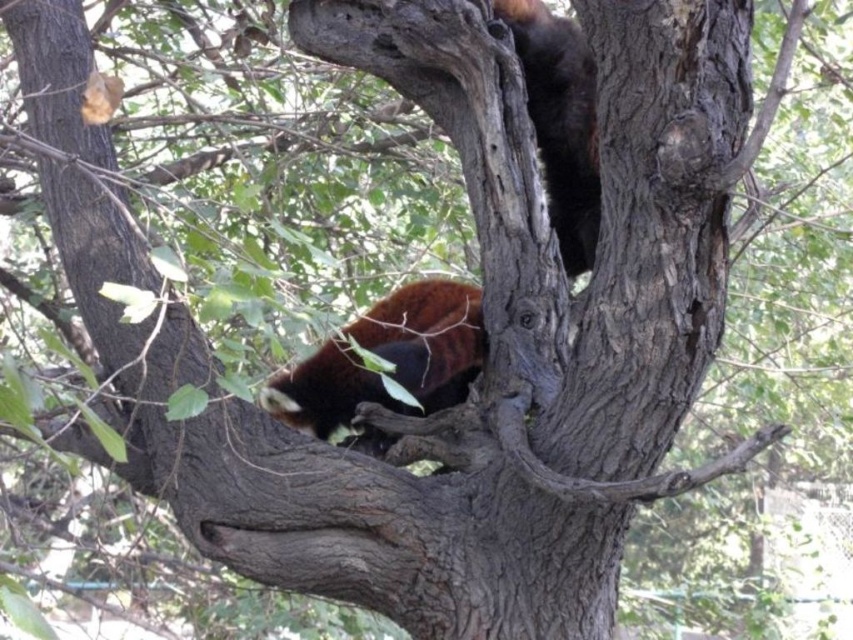
You are a wildlife photographer aiming to capture the red panda in the image. The red panda is located at the point with coordinates point (387, 358). To ensure the best shot, you need to know if the red panda is positioned at the center of the image. Is the red panda at the center?

Yes, the point (387, 358) indicates that the brown furry animal at center is located at the center of the image.

You are a nature photographer trying to capture both the brown furry animal at center and the fuzzy brown bear at upper right in a single frame. Which animal should you adjust your camera focus to first to ensure both are in the shot?

You should focus on the brown furry animal at center first because it is positioned to the left of the fuzzy brown bear at upper right, allowing you to adjust the camera to include both in the frame.